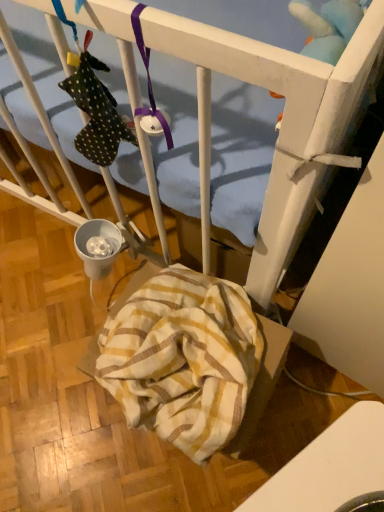
The width and height of the screenshot is (384, 512). What are the coordinates of `blue plush toy at upper right` in the screenshot? It's located at (328, 26).

From the image's perspective, is white glossy table at lower right above yellow striped fabric at lower center?

No.

From a real-world perspective, is white glossy table at lower right on top of yellow striped fabric at lower center?

Yes.

In terms of size, does white glossy table at lower right appear bigger or smaller than yellow striped fabric at lower center?

Considering their sizes, white glossy table at lower right takes up more space than yellow striped fabric at lower center.

Could you tell me if white glossy table at lower right is turned towards yellow striped fabric at lower center?

No.

Is blue plush toy at upper right placed right next to white glossy table at lower right?

No.

From the image's perspective, is blue plush toy at upper right over white glossy table at lower right?

Indeed, from the image's perspective, blue plush toy at upper right is shown above white glossy table at lower right.

Consider the image. Is white glossy table at lower right at the back of blue plush toy at upper right?

No.

Is yellow striped fabric at lower center located outside blue plush toy at upper right?

Absolutely, yellow striped fabric at lower center is external to blue plush toy at upper right.

Considering the positions of objects yellow striped fabric at lower center and blue plush toy at upper right in the image provided, who is more to the right, yellow striped fabric at lower center or blue plush toy at upper right?

Positioned to the right is blue plush toy at upper right.

Looking at this image, would you say yellow striped fabric at lower center is a long distance from blue plush toy at upper right?

No.

Considering their positions, is yellow striped fabric at lower center located in front of or behind blue plush toy at upper right?

Visually, yellow striped fabric at lower center is located behind blue plush toy at upper right.

Does white glossy table at lower right turn towards blue plush toy at upper right?

No, white glossy table at lower right is not oriented towards blue plush toy at upper right.

From the image's perspective, is white glossy table at lower right above or below blue plush toy at upper right?

white glossy table at lower right is below blue plush toy at upper right.

Which is farther, (x=338, y=460) or (x=323, y=47)?

Positioned behind is point (x=323, y=47).

Can we say white glossy table at lower right lies outside blue plush toy at upper right?

Absolutely, white glossy table at lower right is external to blue plush toy at upper right.

Considering the sizes of objects yellow striped fabric at lower center and white glossy table at lower right in the image provided, who is taller, yellow striped fabric at lower center or white glossy table at lower right?

white glossy table at lower right is taller.

Does yellow striped fabric at lower center have a lesser width compared to white glossy table at lower right?

Correct, the width of yellow striped fabric at lower center is less than that of white glossy table at lower right.

Between yellow striped fabric at lower center and white glossy table at lower right, which one has larger size?

white glossy table at lower right is bigger.

Is yellow striped fabric at lower center not within white glossy table at lower right?

Absolutely, yellow striped fabric at lower center is external to white glossy table at lower right.

Which is closer to the camera, (306, 16) or (201, 395)?

Point (306, 16).

Is the position of blue plush toy at upper right more distant than that of yellow striped fabric at lower center?

No, blue plush toy at upper right is closer to the camera.

Based on their sizes in the image, would you say blue plush toy at upper right is bigger or smaller than yellow striped fabric at lower center?

Clearly, blue plush toy at upper right is smaller in size than yellow striped fabric at lower center.

Which of these two, blue plush toy at upper right or yellow striped fabric at lower center, is wider?

Wider between the two is yellow striped fabric at lower center.

The height and width of the screenshot is (512, 384). I want to click on blanket below the white glossy table at lower right (from a real-world perspective), so click(183, 359).

I want to click on toy above the white glossy table at lower right (from the image's perspective), so click(328, 26).

Based on their spatial positions, is yellow striped fabric at lower center or white glossy table at lower right closer to blue plush toy at upper right?

Among the two, yellow striped fabric at lower center is located nearer to blue plush toy at upper right.

Estimate the real-world distances between objects in this image. Which object is further from white glossy table at lower right, yellow striped fabric at lower center or blue plush toy at upper right?

Among the two, blue plush toy at upper right is located further to white glossy table at lower right.

From the image, which object appears to be nearer to blue plush toy at upper right, white glossy table at lower right or yellow striped fabric at lower center?

Based on the image, yellow striped fabric at lower center appears to be nearer to blue plush toy at upper right.

Estimate the real-world distances between objects in this image. Which object is further from white glossy table at lower right, blue plush toy at upper right or yellow striped fabric at lower center?

Based on the image, blue plush toy at upper right appears to be further to white glossy table at lower right.

Considering their positions, is white glossy table at lower right positioned closer to yellow striped fabric at lower center than blue plush toy at upper right?

white glossy table at lower right lies closer to yellow striped fabric at lower center than the other object.

Considering their positions, is blue plush toy at upper right positioned further to yellow striped fabric at lower center than white glossy table at lower right?

The object further to yellow striped fabric at lower center is blue plush toy at upper right.

You are a GUI agent. You are given a task and a screenshot of the screen. Output one action in this format:
    pyautogui.click(x=<x>, y=<y>)
    Task: Click on the blanket that lies between blue plush toy at upper right and white glossy table at lower right from top to bottom
    The image size is (384, 512).
    Given the screenshot: What is the action you would take?
    pyautogui.click(x=183, y=359)